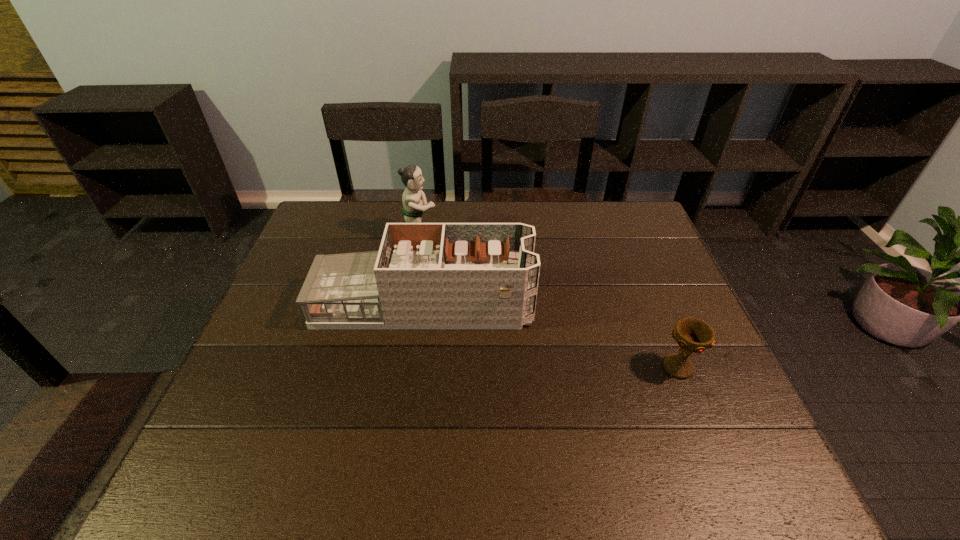
The height and width of the screenshot is (540, 960). In order to click on free region that satisfies the following two spatial constraints: 1. at the entrance of the chalice; 2. on the left side of the dollhouse in this screenshot , I will do (416, 368).

Locate an element on the screen. free location that satisfies the following two spatial constraints: 1. on the front-facing side of the chalice; 2. on the left side of the tallest object is located at coordinates (396, 368).

Find the location of `free space that satisfies the following two spatial constraints: 1. at the entrance of the second shortest object; 2. on the left side of the chalice`. free space that satisfies the following two spatial constraints: 1. at the entrance of the second shortest object; 2. on the left side of the chalice is located at coordinates (416, 368).

You are a GUI agent. You are given a task and a screenshot of the screen. Output one action in this format:
    pyautogui.click(x=<x>, y=<y>)
    Task: Click on the free spot that satisfies the following two spatial constraints: 1. at the entrance of the dollhouse; 2. on the right side of the shortest object
    Image resolution: width=960 pixels, height=540 pixels.
    Given the screenshot: What is the action you would take?
    pyautogui.click(x=416, y=368)

Find the location of a particular element. This screenshot has height=540, width=960. free space that satisfies the following two spatial constraints: 1. on the front-facing side of the tallest object; 2. on the right side of the shortest object is located at coordinates (396, 368).

Locate an element on the screen. free space that satisfies the following two spatial constraints: 1. on the front-facing side of the farthest object; 2. on the right side of the chalice is located at coordinates (396, 368).